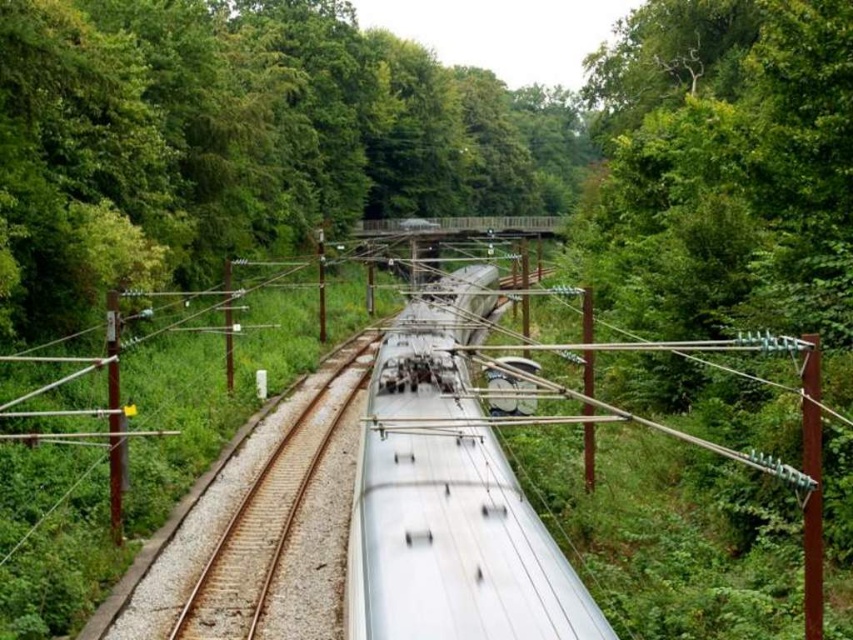
Which is more to the left, silver metallic train at center or metallic silver train track at center?

metallic silver train track at center is more to the left.

Which is behind, point (476, 541) or point (306, 461)?

Point (306, 461)

Find the location of a particular element. This screenshot has width=853, height=640. silver metallic train at center is located at coordinates (450, 497).